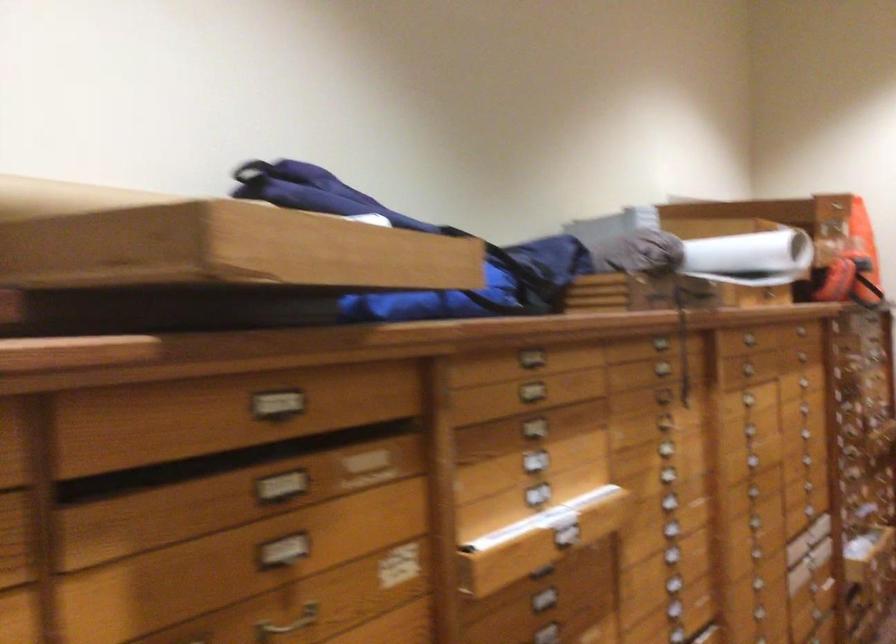
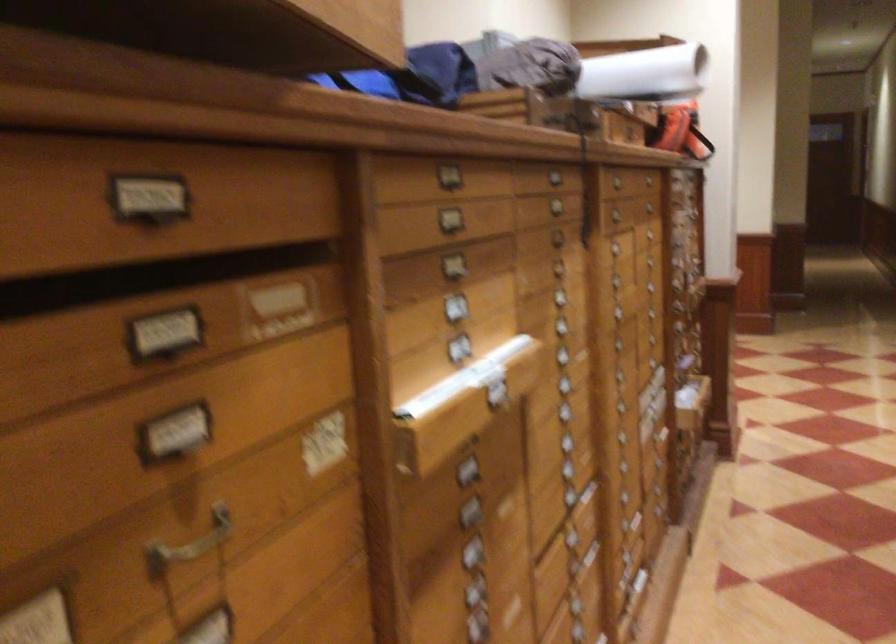
Question: The camera is either moving clockwise (left) or counter-clockwise (right) around the object. The first image is from the beginning of the video and the second image is from the end. Is the camera moving left or right when shooting the video?

Choices:
 (A) Left
 (B) Right

Answer: (A)